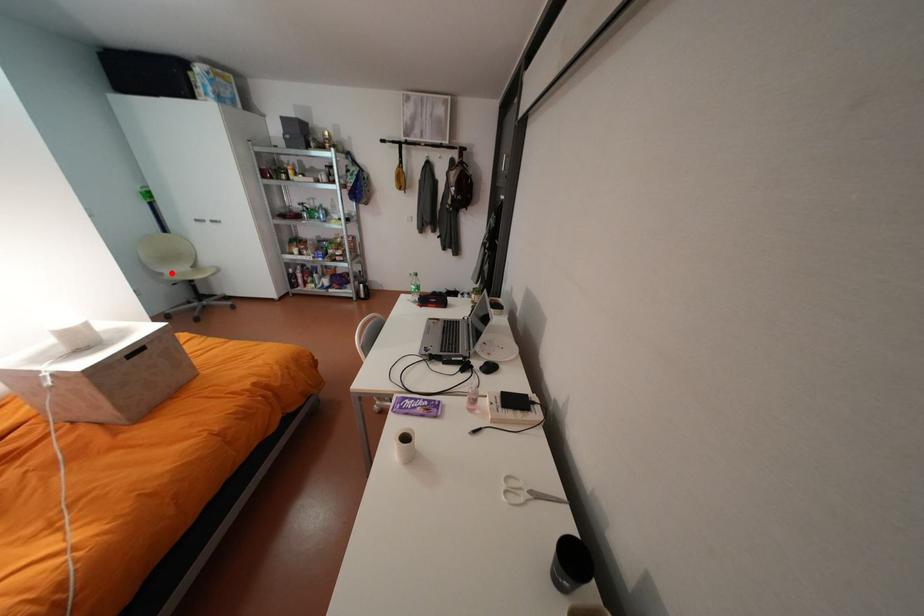
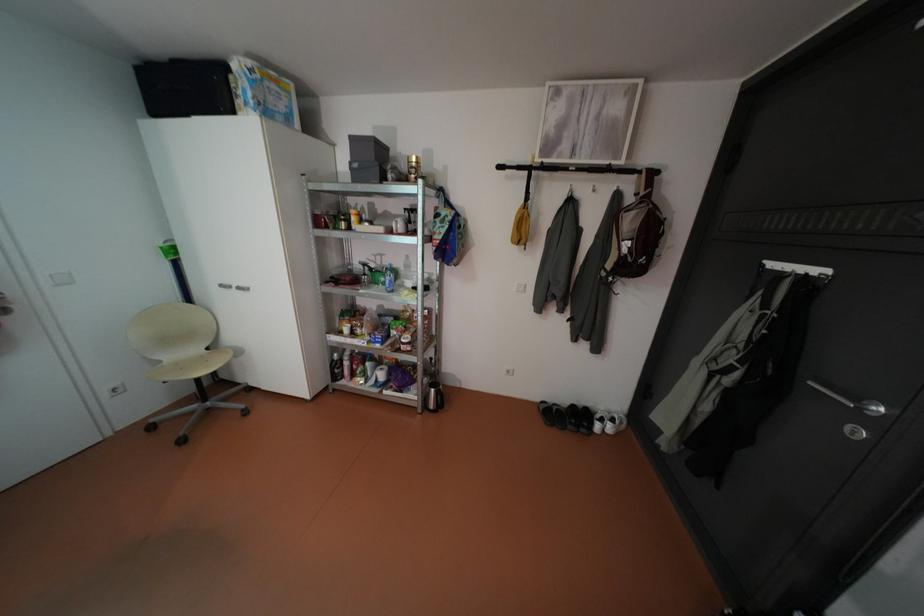
Find the pixel in the second image that matches the highlighted location in the first image.

(168, 361)